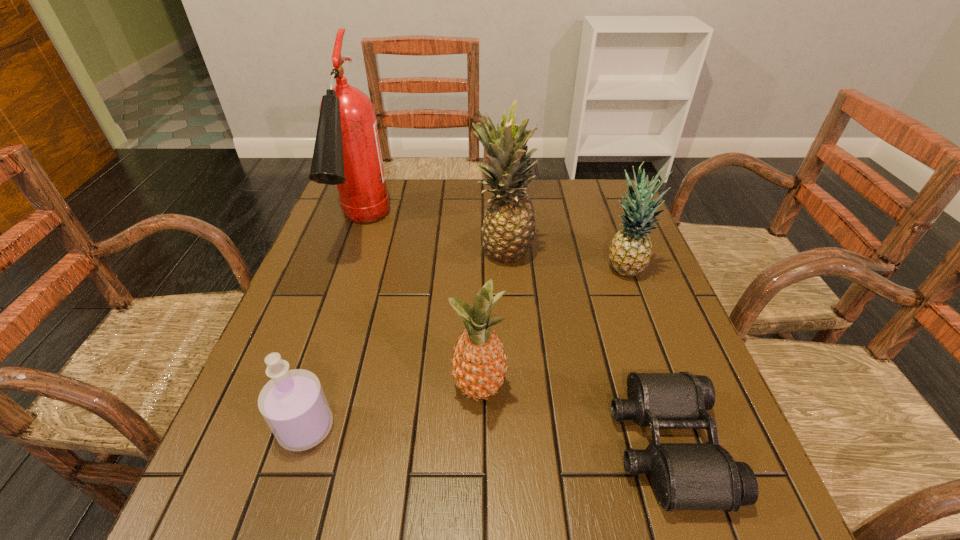
Find the location of a particular element. This screenshot has height=540, width=960. object that is at the far left corner is located at coordinates (347, 153).

Identify the location of object located at the near right corner. (685, 476).

In the image, there is a desktop. At what (x,y) coordinates should I click in order to perform the action: click on vacant region at the far edge. Please return your answer as a coordinate pair (x, y). This screenshot has height=540, width=960. Looking at the image, I should click on (392, 217).

Locate an element on the screen. This screenshot has height=540, width=960. vacant region at the near edge of the desktop is located at coordinates (456, 501).

What are the coordinates of `free space at the left edge of the desktop` in the screenshot? It's located at (276, 348).

Identify the location of vacant space at the right edge. (636, 326).

Locate an element on the screen. This screenshot has height=540, width=960. vacant point at the far left corner is located at coordinates (336, 210).

In order to click on free spot at the far right corner of the desktop in this screenshot , I will do `click(570, 186)`.

Image resolution: width=960 pixels, height=540 pixels. In order to click on vacant space that's between the second shortest object and the tallest object in this screenshot , I will do `click(334, 328)`.

The image size is (960, 540). I want to click on free area in between the perfume and the tallest object, so click(x=334, y=328).